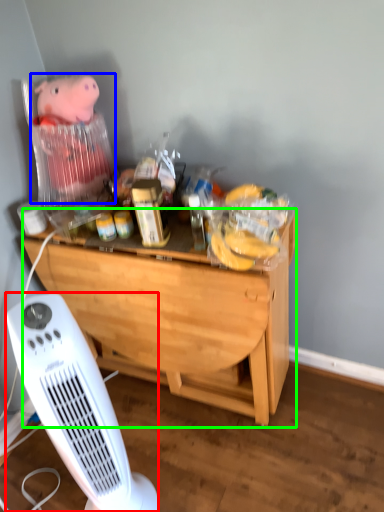
Question: Which object is the closest to the home appliance (highlighted by a red box)? Choose among these: toy (highlighted by a blue box) or desk (highlighted by a green box).

Choices:
 (A) toy
 (B) desk

Answer: (B)